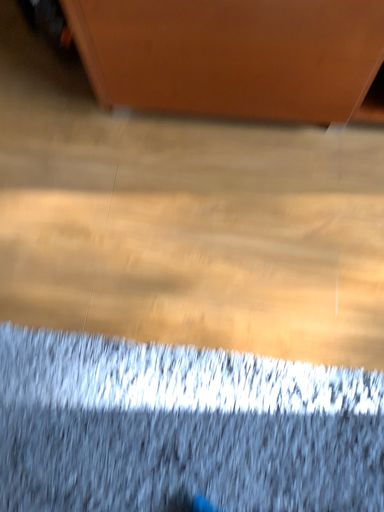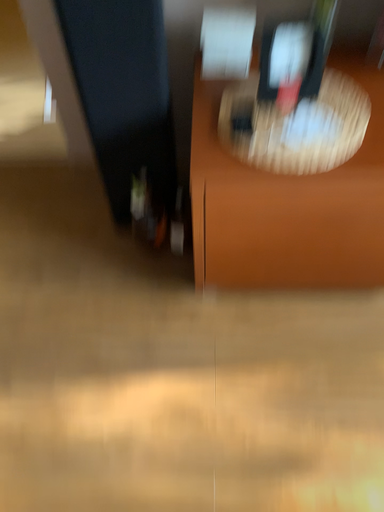
Question: How did the camera likely rotate when shooting the video?

Choices:
 (A) rotated upward
 (B) rotated downward

Answer: (A)